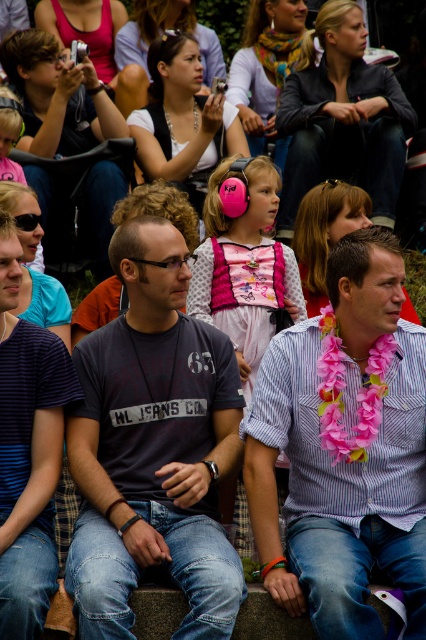
You are standing at point (417,488) and want to walk to point (158,493). Is the point you want to reach in front of or behind you?

The point (158,493) is behind point (417,488), so the destination is behind you.